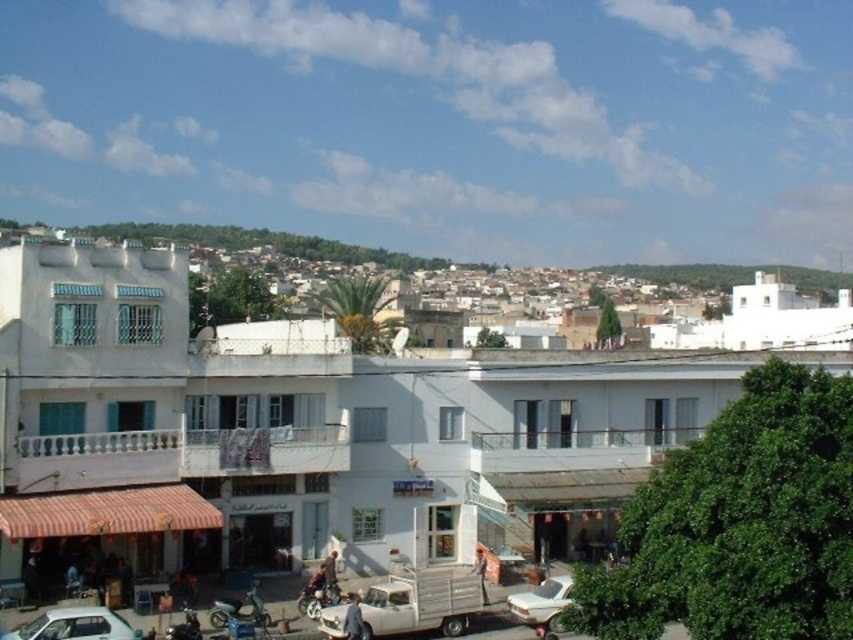
Question: Can you confirm if white matte building at center is positioned above metallic blue motorcycle at lower center?

Choices:
 (A) yes
 (B) no

Answer: (A)

Question: Which object is the farthest from the metallic silver motorcycle at center?

Choices:
 (A) shiny chrome motorcycle at lower left
 (B) white matte car at lower left
 (C) white matte building at center
 (D) metallic blue motorcycle at lower center

Answer: (C)

Question: Which object appears closest to the camera in this image?

Choices:
 (A) shiny chrome motorcycle at lower left
 (B) metallic blue motorcycle at lower center

Answer: (A)

Question: Does white matte building at center lie behind shiny chrome motorcycle at lower left?

Choices:
 (A) no
 (B) yes

Answer: (B)

Question: Considering the real-world distances, which object is farthest from the metallic blue motorcycle at lower center?

Choices:
 (A) metallic silver motorcycle at center
 (B) white matte building at center
 (C) white matte car at lower left
 (D) shiny chrome motorcycle at lower left

Answer: (B)

Question: Can you confirm if white matte car at lower left is bigger than shiny chrome motorcycle at lower left?

Choices:
 (A) yes
 (B) no

Answer: (A)